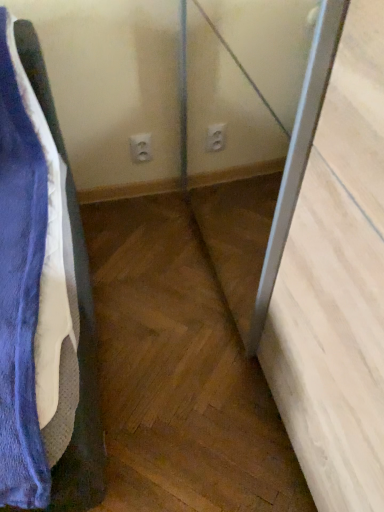
Question: Considering the positions of clear glass screen door at center and white plastic electric outlet at center in the image, is clear glass screen door at center wider or thinner than white plastic electric outlet at center?

Choices:
 (A) thin
 (B) wide

Answer: (B)

Question: From the image's perspective, is clear glass screen door at center positioned above or below white plastic electric outlet at center?

Choices:
 (A) below
 (B) above

Answer: (A)

Question: From a real-world perspective, is clear glass screen door at center physically located above or below white plastic electric outlet at center?

Choices:
 (A) above
 (B) below

Answer: (A)

Question: Based on their sizes in the image, would you say white plastic electric outlet at center is bigger or smaller than clear glass screen door at center?

Choices:
 (A) big
 (B) small

Answer: (B)

Question: Is white plastic electric outlet at center wider or thinner than clear glass screen door at center?

Choices:
 (A) thin
 (B) wide

Answer: (A)

Question: Considering the positions of point (145, 134) and point (205, 183), is point (145, 134) closer or farther from the camera than point (205, 183)?

Choices:
 (A) closer
 (B) farther

Answer: (A)

Question: From the image's perspective, is white plastic electric outlet at center located above or below clear glass screen door at center?

Choices:
 (A) above
 (B) below

Answer: (A)